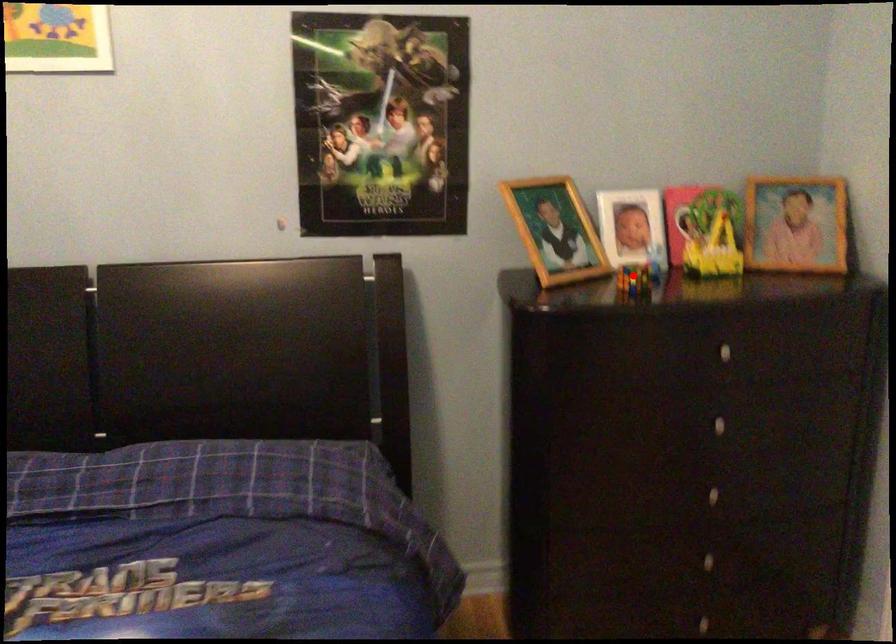
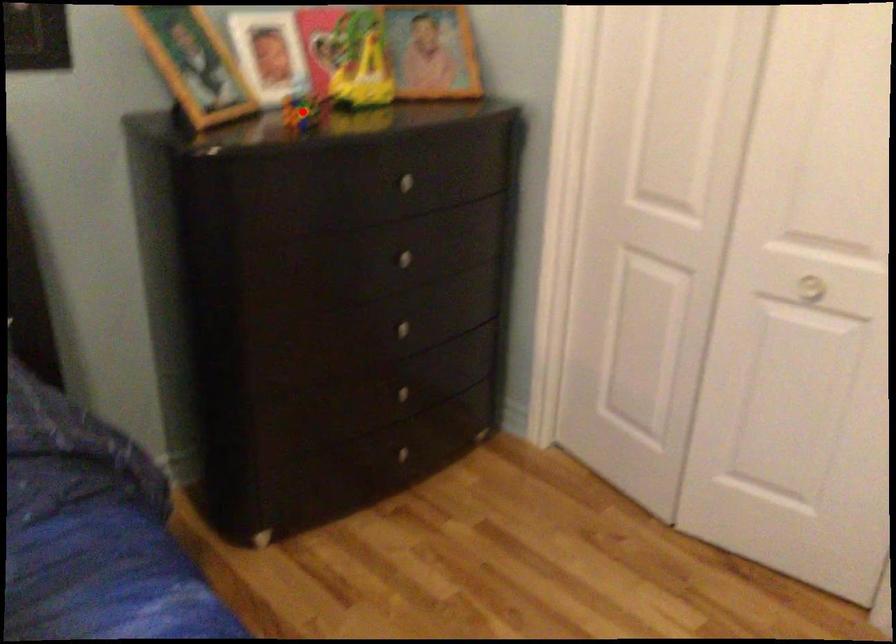
I am providing you with two images of the same scene from different viewpoints. A red point is marked on the first image and another point is marked on the second image. Are the points marked in image1 and image2 representing the same 3D position?

Yes